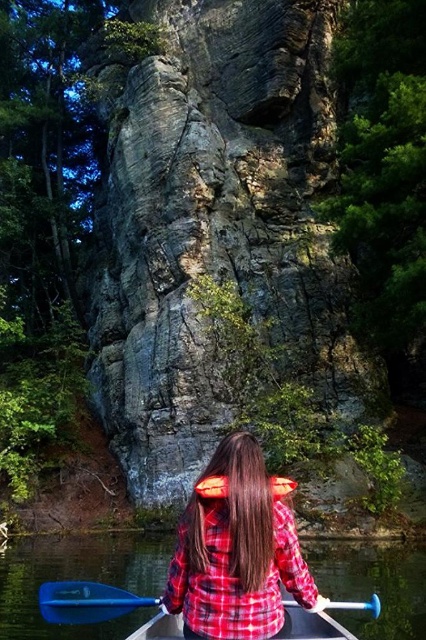
You are planning to take a photo of the clear water at lower center and the blue plastic canoe at center. Which object should you focus on first if you want to capture both in a single frame without moving the camera?

The blue plastic canoe at center should be focused on first because it is larger than the clear water at lower center, allowing it to anchor the composition while still including the smaller water area in the frame.

You are a photographer trying to capture the person in the canoe. The point at coordinates (x=236, y=548) marks the plaid fabric shirt at center. If you want to focus on the red plaid shirt at center, where should you aim your camera?

The point at coordinates (x=236, y=548) marks the plaid fabric shirt at center, so you should aim your camera at that point to focus on the red plaid shirt at center.